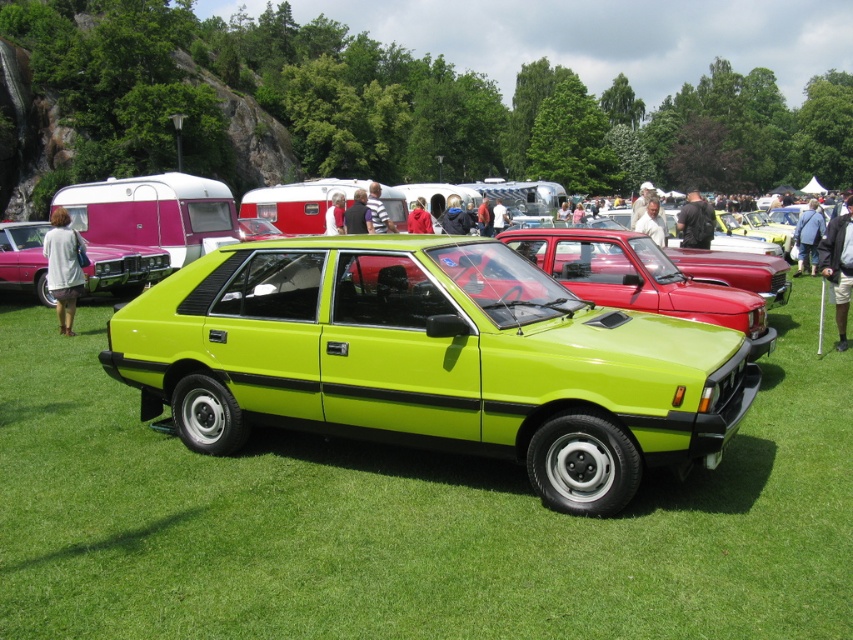
Is point (677, 378) in front of point (18, 236)?

Yes.

Which is above, lime green plastic car at center or matte pink car at left?

matte pink car at left

Is point (674, 385) positioned in front of point (90, 260)?

Yes, it is in front of point (90, 260).

You are a GUI agent. You are given a task and a screenshot of the screen. Output one action in this format:
    pyautogui.click(x=<x>, y=<y>)
    Task: Click on the lime green plastic car at center
    The height and width of the screenshot is (640, 853).
    Given the screenshot: What is the action you would take?
    432,360